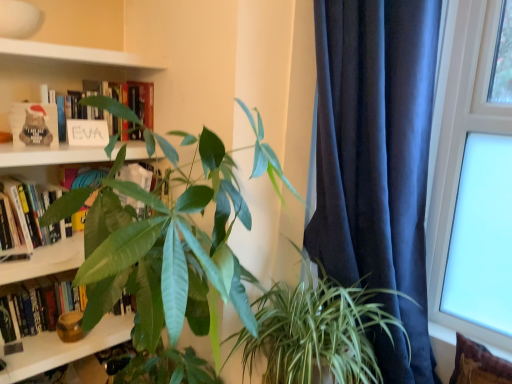
Question: Could brown textured pillow at lower right be considered to be inside white matte sign at upper left, the third book ordered from the bottom?

Choices:
 (A) no
 (B) yes

Answer: (A)

Question: Is white matte sign at upper left, the third book ordered from the bottom, taller than brown textured pillow at lower right?

Choices:
 (A) yes
 (B) no

Answer: (A)

Question: Considering the relative positions of white matte sign at upper left, which is the 1th book in top-to-bottom order, and brown textured pillow at lower right in the image provided, is white matte sign at upper left, which is the 1th book in top-to-bottom order, to the right of brown textured pillow at lower right from the viewer's perspective?

Choices:
 (A) yes
 (B) no

Answer: (B)

Question: Does white matte sign at upper left, which is the 1th book in top-to-bottom order, have a greater width compared to brown textured pillow at lower right?

Choices:
 (A) yes
 (B) no

Answer: (A)

Question: From a real-world perspective, is white matte sign at upper left, the third book ordered from the bottom, positioned over brown textured pillow at lower right based on gravity?

Choices:
 (A) no
 (B) yes

Answer: (B)

Question: Considering the positions of point (68, 170) and point (507, 110), is point (68, 170) closer or farther from the camera than point (507, 110)?

Choices:
 (A) farther
 (B) closer

Answer: (A)

Question: Based on their positions, is hardcover book at upper left, which is the 2th book in top-to-bottom order, located to the left or right of transparent glass window at upper right?

Choices:
 (A) left
 (B) right

Answer: (A)

Question: Considering their positions, is hardcover book at upper left, the second book ordered from the bottom, located in front of or behind transparent glass window at upper right?

Choices:
 (A) front
 (B) behind

Answer: (B)

Question: Looking at the image, does hardcover book at upper left, which is the 2th book in top-to-bottom order, seem bigger or smaller compared to transparent glass window at upper right?

Choices:
 (A) big
 (B) small

Answer: (B)

Question: In the image, is hardcover book at upper left, which is the 2th book in top-to-bottom order, positioned in front of or behind hardcover book at left, the 1th book ordered from the bottom?

Choices:
 (A) front
 (B) behind

Answer: (A)

Question: Is hardcover book at upper left, the second book ordered from the bottom, situated inside hardcover book at left, acting as the third book starting from the top, or outside?

Choices:
 (A) inside
 (B) outside

Answer: (B)

Question: Considering the positions of point (99, 182) and point (67, 296), is point (99, 182) closer or farther from the camera than point (67, 296)?

Choices:
 (A) closer
 (B) farther

Answer: (A)

Question: Looking at the image, does hardcover book at upper left, the second book ordered from the bottom, seem bigger or smaller compared to hardcover book at left, acting as the third book starting from the top?

Choices:
 (A) small
 (B) big

Answer: (A)

Question: Is brown textured pillow at lower right taller or shorter than hardcover book at left, acting as the third book starting from the top?

Choices:
 (A) tall
 (B) short

Answer: (B)

Question: Is point (458, 342) positioned closer to the camera than point (14, 327)?

Choices:
 (A) closer
 (B) farther

Answer: (A)